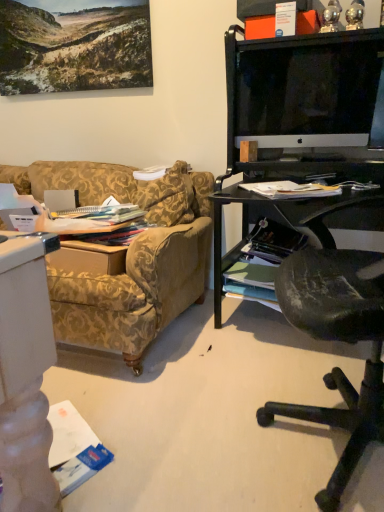
Question: Relative to white glossy monitor at upper right, is white paper magazine at right, placed as the second magazine when sorted from back to front, in front or behind?

Choices:
 (A) front
 (B) behind

Answer: (A)

Question: Considering the positions of white paper magazine at right, placed as the second magazine when sorted from back to front, and white glossy monitor at upper right in the image, is white paper magazine at right, placed as the second magazine when sorted from back to front, bigger or smaller than white glossy monitor at upper right?

Choices:
 (A) big
 (B) small

Answer: (B)

Question: Which of these objects is positioned closest to the shiny metallic magazine at lower right, arranged as the first magazine when ordered from the bottom?

Choices:
 (A) white glossy monitor at upper right
 (B) white paper magazine at right, marked as the first magazine in a top-to-bottom arrangement

Answer: (B)

Question: Based on their relative distances, which object is nearer to the white glossy monitor at upper right?

Choices:
 (A) white paper magazine at right, arranged as the 2th magazine when ordered from the bottom
 (B) shiny metallic magazine at lower right, arranged as the first magazine when ordered from the bottom

Answer: (A)